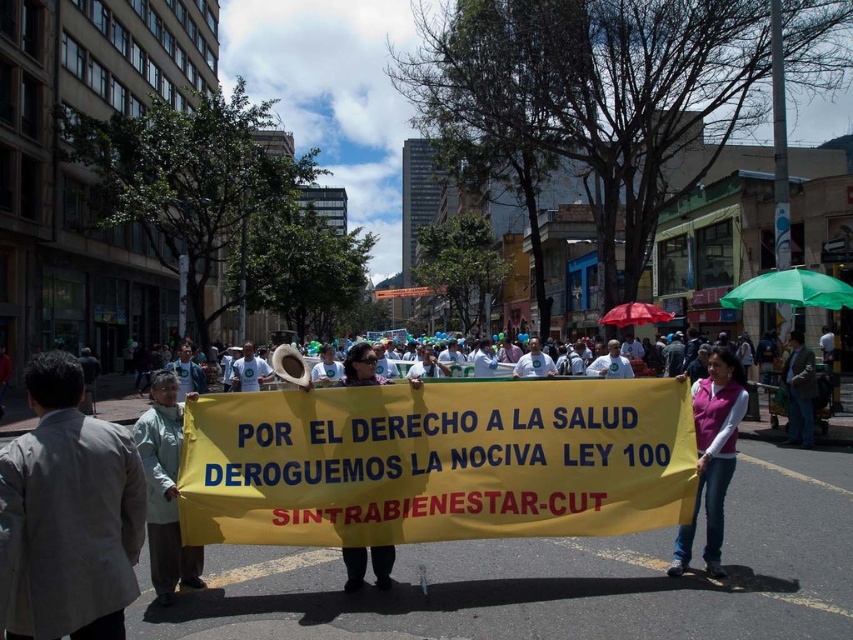
Question: Which point is closer to the camera?

Choices:
 (A) (810, 404)
 (B) (724, 486)
 (C) (360, 342)

Answer: (B)

Question: Does yellow paper banner at center come behind light green fabric at center?

Choices:
 (A) no
 (B) yes

Answer: (A)

Question: Which object is positioned closest to the light green fabric at center?

Choices:
 (A) green fabric umbrella at right
 (B) pink fleece vest at center

Answer: (B)

Question: Which object appears closest to the camera in this image?

Choices:
 (A) pink fabric shirt at center
 (B) matte yellow banner at center

Answer: (B)

Question: Can you confirm if green fabric umbrella at right is smaller than matte yellow banner at center?

Choices:
 (A) no
 (B) yes

Answer: (A)

Question: Can you confirm if pink fleece vest at center is bigger than pink fabric shirt at center?

Choices:
 (A) no
 (B) yes

Answer: (A)